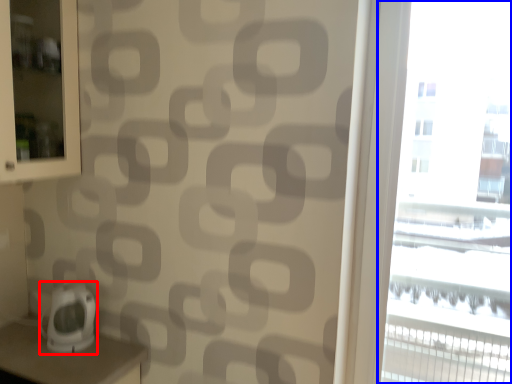
Question: Among these objects, which one is nearest to the camera, appliance (highlighted by a red box) or window (highlighted by a blue box)?

Choices:
 (A) appliance
 (B) window

Answer: (B)